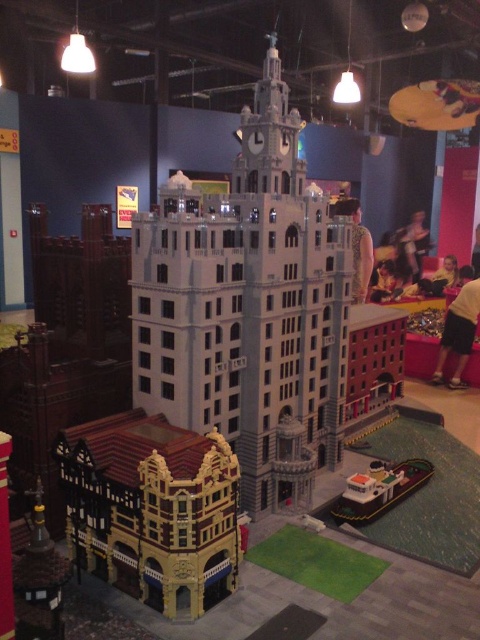
Between point (331, 384) and point (107, 460), which one is positioned behind?

The point (331, 384) is behind.

Locate an element on the screen. light gray lego tower at center is located at coordinates (248, 307).

In the scene shown: Does light gray lego tower at center have a greater height compared to white plastic boat at lower right?

Correct, light gray lego tower at center is much taller as white plastic boat at lower right.

Who is more distant from viewer, (159, 385) or (373, 486)?

Point (373, 486)

This screenshot has height=640, width=480. Find the location of `light gray lego tower at center`. light gray lego tower at center is located at coordinates (248, 307).

Which is more to the right, brown textured building at lower left or white plastic boat at lower right?

From the viewer's perspective, white plastic boat at lower right appears more on the right side.

Is point (164, 570) positioned in front of point (392, 492)?

Yes, point (164, 570) is in front of point (392, 492).

Where is `brown textured building at lower left`? brown textured building at lower left is located at coordinates (153, 509).